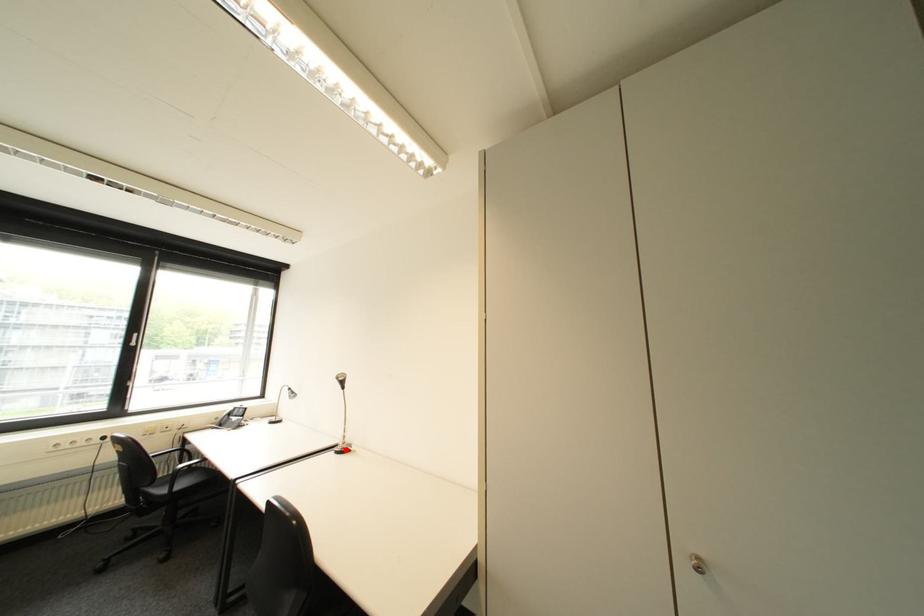
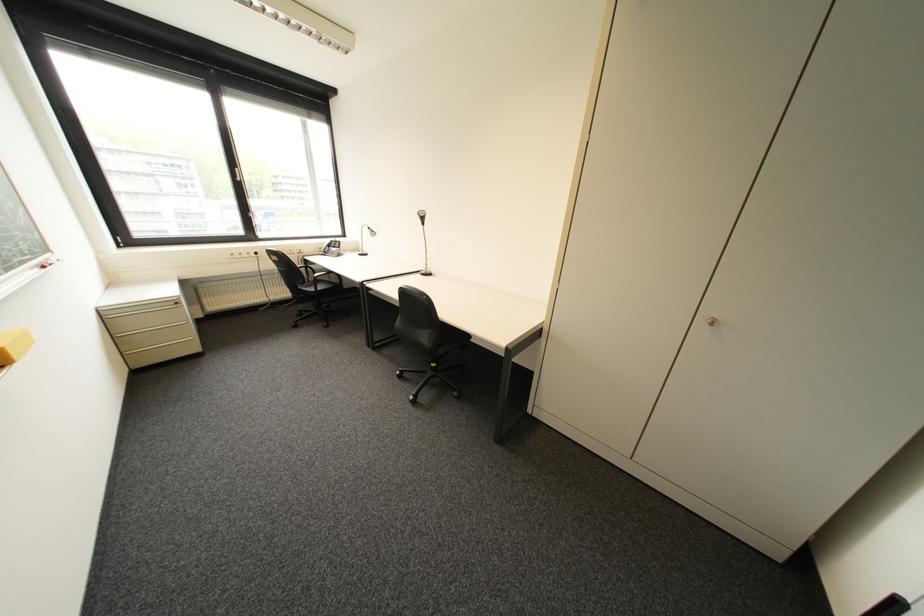
The point at the highlighted location is marked in the first image. Where is the corresponding point in the second image?

(432, 273)